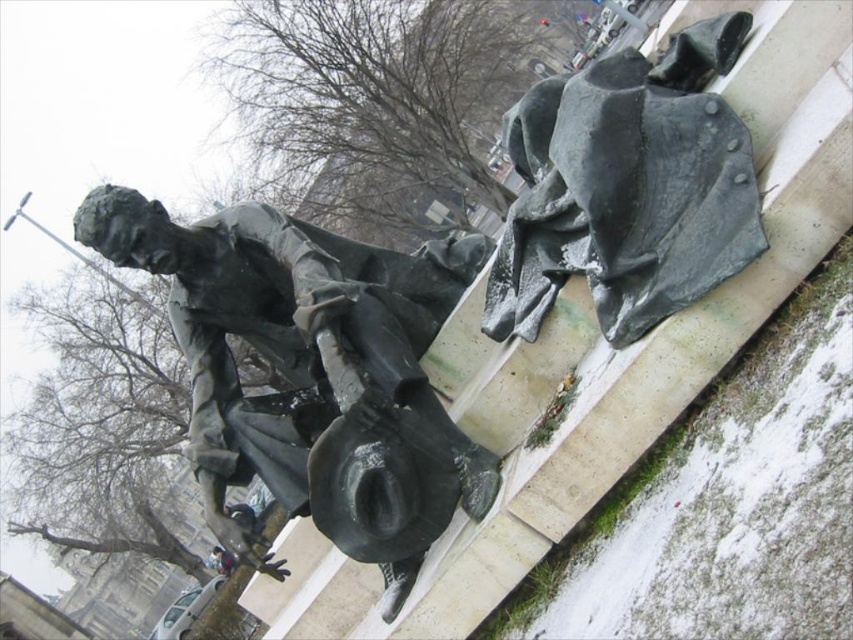
Question: Can you confirm if bronze statue at center is smaller than rusty metal cape at upper right?

Choices:
 (A) yes
 (B) no

Answer: (B)

Question: Can you confirm if bronze statue at center is positioned above rusty metal cape at upper right?

Choices:
 (A) yes
 (B) no

Answer: (B)

Question: Which point is closer to the camera taking this photo?

Choices:
 (A) (173, 225)
 (B) (631, 122)

Answer: (B)

Question: Which object appears closest to the camera in this image?

Choices:
 (A) rusty metal cape at upper right
 (B) bronze statue at center

Answer: (A)

Question: Does bronze statue at center appear over rusty metal cape at upper right?

Choices:
 (A) no
 (B) yes

Answer: (A)

Question: Which point is farther to the camera?

Choices:
 (A) bronze statue at center
 (B) rusty metal cape at upper right

Answer: (A)